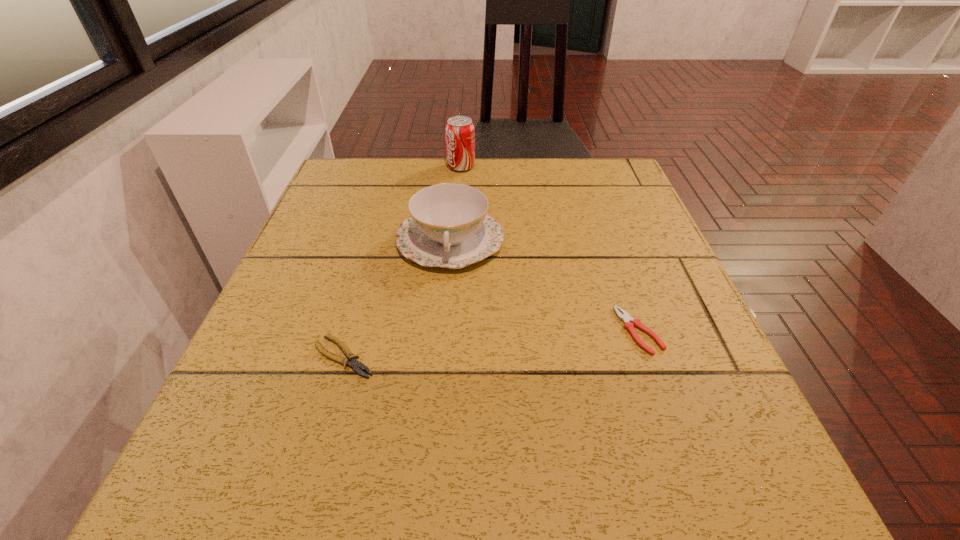
In order to click on the tallest object in this screenshot , I will do `click(460, 134)`.

The image size is (960, 540). What are the coordinates of `the farthest object` in the screenshot? It's located at (460, 134).

Identify the location of the second tallest object. (449, 226).

Where is `chinaware`? This screenshot has height=540, width=960. chinaware is located at coordinates (449, 226).

This screenshot has height=540, width=960. What are the coordinates of `the rightmost object` in the screenshot? It's located at (629, 323).

Image resolution: width=960 pixels, height=540 pixels. I want to click on the left pliers, so click(355, 364).

In order to click on vacant region located on the left of the tallest object in this screenshot , I will do `click(369, 167)`.

Locate an element on the screen. free space located 0.320m on the handle side of the second tallest object is located at coordinates (435, 427).

The height and width of the screenshot is (540, 960). What are the coordinates of `free space located 0.390m on the back of the right pliers` in the screenshot? It's located at (590, 193).

Identify the location of free space located on the right of the left pliers. (607, 357).